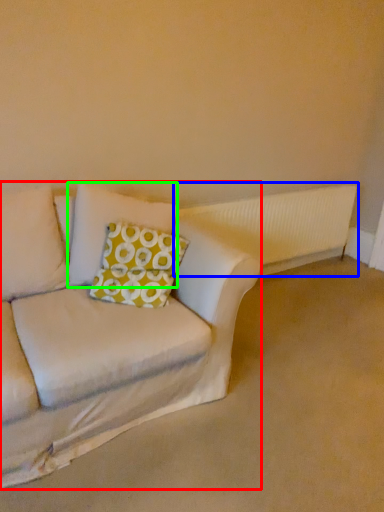
Question: Estimate the real-world distances between objects in this image. Which object is farther from studio couch (highlighted by a red box), radiator (highlighted by a blue box) or pillow (highlighted by a green box)?

Choices:
 (A) radiator
 (B) pillow

Answer: (A)